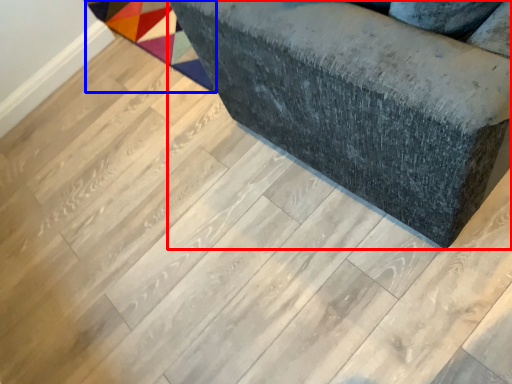
Question: Which object appears farthest to the camera in this image, furniture (highlighted by a red box) or mat (highlighted by a blue box)?

Choices:
 (A) furniture
 (B) mat

Answer: (B)